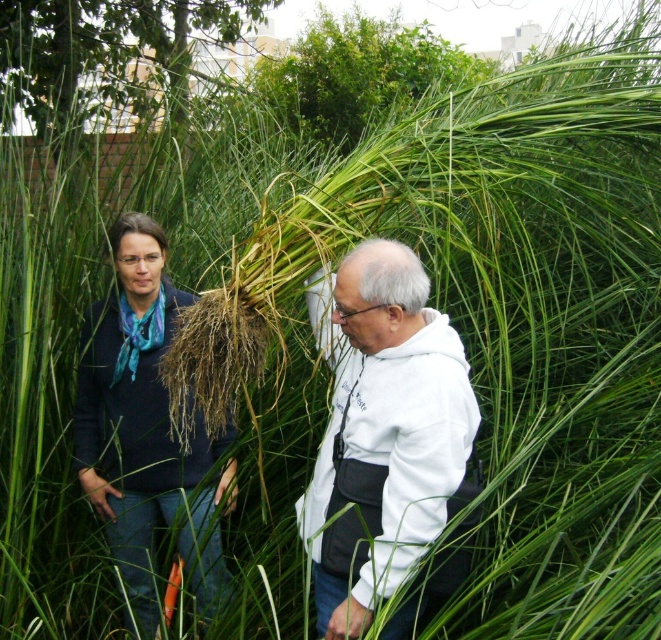
Question: Does blue fabric scarf at left have a greater width compared to green leafy bush at upper center?

Choices:
 (A) no
 (B) yes

Answer: (A)

Question: Among these objects, which one is farthest from the camera?

Choices:
 (A) white fleece jacket at center
 (B) white hoodie at center
 (C) blue fabric scarf at left
 (D) green leafy bush at upper center

Answer: (D)

Question: Does white hoodie at center appear over blue fabric scarf at left?

Choices:
 (A) yes
 (B) no

Answer: (B)

Question: Which of the following is the closest to the observer?

Choices:
 (A) (137, 300)
 (B) (102, 433)

Answer: (A)

Question: Is white fleece jacket at center bigger than white hoodie at center?

Choices:
 (A) no
 (B) yes

Answer: (A)

Question: Among these points, which one is nearest to the camera?

Choices:
 (A) (270, 86)
 (B) (459, 362)

Answer: (B)